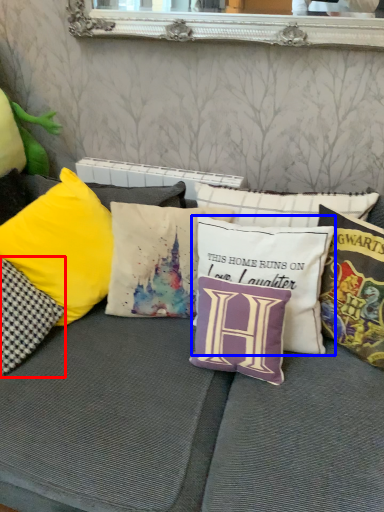
Question: Which point is closer to the camera, pillow (highlighted by a red box) or pillow (highlighted by a blue box)?

Choices:
 (A) pillow
 (B) pillow

Answer: (A)